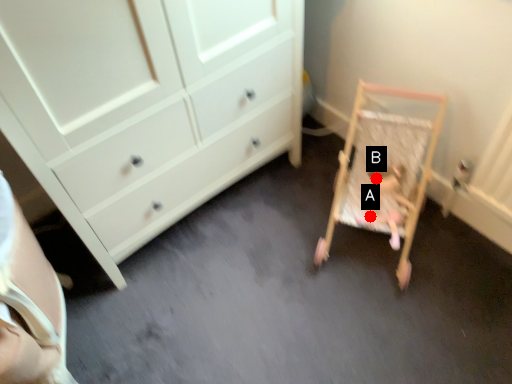
Question: Two points are circled on the image, labeled by A and B beside each circle. Which point is farther to the camera?

Choices:
 (A) A is further
 (B) B is further

Answer: (B)